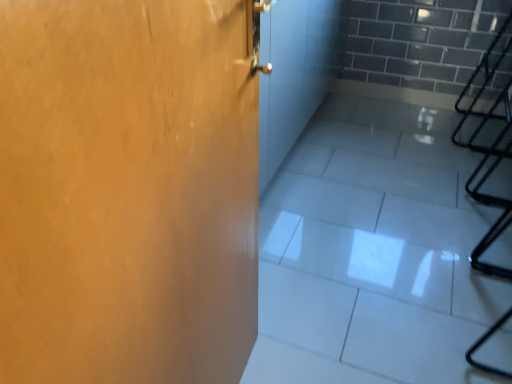
What do you see at coordinates (127, 192) in the screenshot? The image size is (512, 384). I see `matte wood door at left` at bounding box center [127, 192].

What is the approximate width of matte wood door at left?

It is 3.81 inches.

Where is `matte wood door at left`? matte wood door at left is located at coordinates (127, 192).

This screenshot has height=384, width=512. Identify the location of white glossy tile at center. (372, 253).

What do you see at coordinates (372, 253) in the screenshot? I see `white glossy tile at center` at bounding box center [372, 253].

Locate an element on the screen. This screenshot has height=384, width=512. matte wood door at left is located at coordinates (127, 192).

Which is more to the right, white glossy tile at center or matte wood door at left?

white glossy tile at center.

In the image, is white glossy tile at center positioned in front of or behind matte wood door at left?

In the image, white glossy tile at center appears behind matte wood door at left.

Is point (419, 216) in front of point (21, 342)?

No, it is behind (21, 342).

From the image's perspective, relative to matte wood door at left, is white glossy tile at center above or below?

Clearly, from the image's perspective, white glossy tile at center is above matte wood door at left.

From a real-world perspective, is white glossy tile at center on top of matte wood door at left?

Incorrect, from a real-world perspective, white glossy tile at center is lower than matte wood door at left.

Can you confirm if white glossy tile at center is thinner than matte wood door at left?

No.

In terms of height, does white glossy tile at center look taller or shorter compared to matte wood door at left?

In the image, white glossy tile at center appears to be shorter than matte wood door at left.

Based on their sizes in the image, would you say white glossy tile at center is bigger or smaller than matte wood door at left?

white glossy tile at center is bigger than matte wood door at left.

Is white glossy tile at center not inside matte wood door at left?

Absolutely, white glossy tile at center is external to matte wood door at left.

Is white glossy tile at center directly adjacent to matte wood door at left?

No, white glossy tile at center is not in contact with matte wood door at left.

Is matte wood door at left at the back of white glossy tile at center?

No, matte wood door at left is not at the back of white glossy tile at center.

How many degrees apart are the facing directions of white glossy tile at center and matte wood door at left?

There is a 95-degree angle between the facing directions of white glossy tile at center and matte wood door at left.

How far apart are white glossy tile at center and matte wood door at left?

95.64 centimeters.

The width and height of the screenshot is (512, 384). Identify the location of concrete on the right of matte wood door at left. (372, 253).

Considering the positions of objects matte wood door at left and white glossy tile at center in the image provided, who is more to the right, matte wood door at left or white glossy tile at center?

Positioned to the right is white glossy tile at center.

Relative to white glossy tile at center, is matte wood door at left in front or behind?

In the image, matte wood door at left appears in front of white glossy tile at center.

Which point is more forward, (239,34) or (283,168)?

The point (239,34) is closer to the camera.

From the image's perspective, which is above, matte wood door at left or white glossy tile at center?

From the image's view, white glossy tile at center is above.

From a real-world perspective, relative to white glossy tile at center, is matte wood door at left vertically above or below?

matte wood door at left is situated higher than white glossy tile at center in the real world.

Which of these two, matte wood door at left or white glossy tile at center, is thinner?

matte wood door at left.

Does matte wood door at left have a greater height compared to white glossy tile at center?

Indeed, matte wood door at left has a greater height compared to white glossy tile at center.

In terms of size, does matte wood door at left appear bigger or smaller than white glossy tile at center?

In the image, matte wood door at left appears to be smaller than white glossy tile at center.

Is white glossy tile at center surrounded by matte wood door at left?

No, white glossy tile at center is not surrounded by matte wood door at left.

Is matte wood door at left not near white glossy tile at center?

No, matte wood door at left is not far away from white glossy tile at center.

Could you tell me if matte wood door at left is turned towards white glossy tile at center?

No.

What's the angular difference between matte wood door at left and white glossy tile at center's facing directions?

They differ by 95 degrees in their facing directions.

You are a GUI agent. You are given a task and a screenshot of the screen. Output one action in this format:
    pyautogui.click(x=<x>, y=<y>)
    Task: Click on the door lying in front of the white glossy tile at center
    
    Given the screenshot: What is the action you would take?
    pyautogui.click(x=127, y=192)

At what (x,y) coordinates should I click in order to perform the action: click on door that is above the white glossy tile at center (from a real-world perspective). Please return your answer as a coordinate pair (x, y). Looking at the image, I should click on (127, 192).

Identify the location of concrete below the matte wood door at left (from a real-world perspective). This screenshot has height=384, width=512. (372, 253).